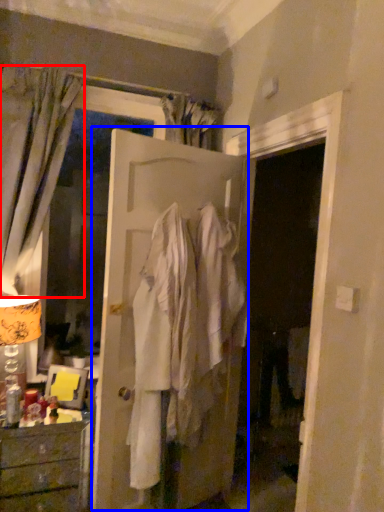
Question: Which of the following is the farthest to the observer, curtain (highlighted by a red box) or door (highlighted by a blue box)?

Choices:
 (A) curtain
 (B) door

Answer: (A)